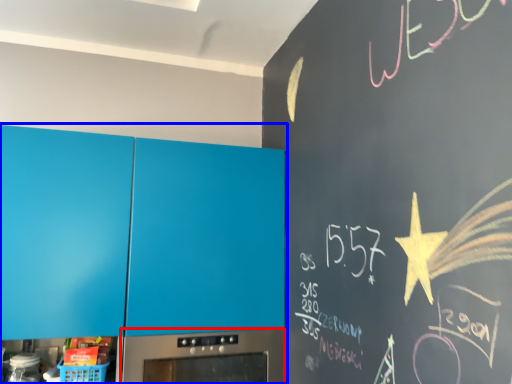
Question: Which point is closer to the camera, home appliance (highlighted by a red box) or cabinetry (highlighted by a blue box)?

Choices:
 (A) home appliance
 (B) cabinetry

Answer: (B)